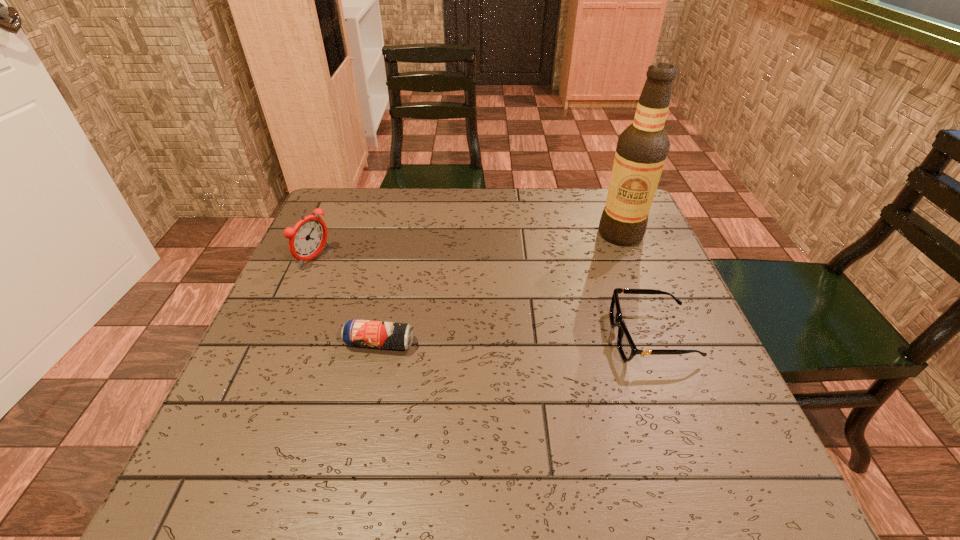
The width and height of the screenshot is (960, 540). I want to click on free space that satisfies the following two spatial constraints: 1. on the back side of the alcohol; 2. on the right side of the leftmost object, so click(325, 234).

At what (x,y) coordinates should I click in order to perform the action: click on vacant space that satisfies the following two spatial constraints: 1. on the front side of the sunglasses; 2. on the front-facing side of the leftmost object. Please return your answer as a coordinate pair (x, y). This screenshot has width=960, height=540. Looking at the image, I should click on (280, 337).

Find the location of a particular element. free space in the image that satisfies the following two spatial constraints: 1. on the back side of the beer can; 2. on the front-facing side of the sunglasses is located at coordinates (381, 337).

Find the location of a particular element. The height and width of the screenshot is (540, 960). free space that satisfies the following two spatial constraints: 1. on the back side of the sunglasses; 2. on the front-facing side of the third object from right to left is located at coordinates (381, 337).